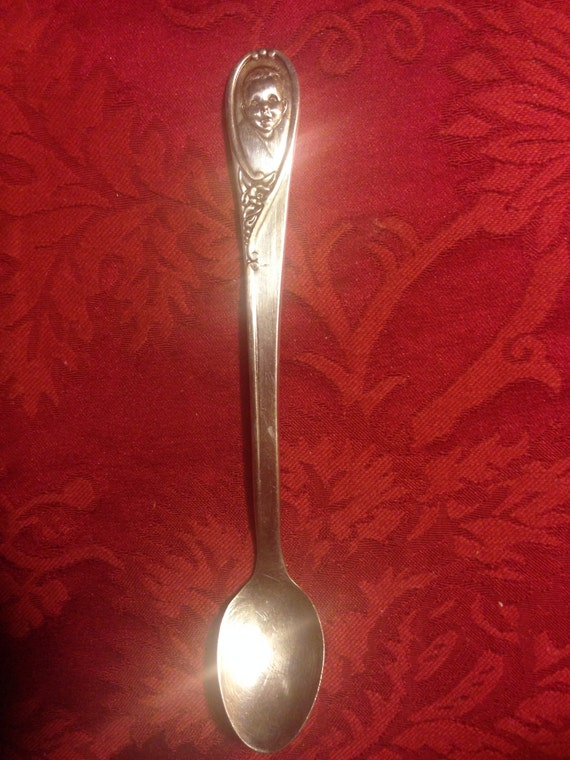
Locate an element on the screen. red table cloth is located at coordinates (378, 122).